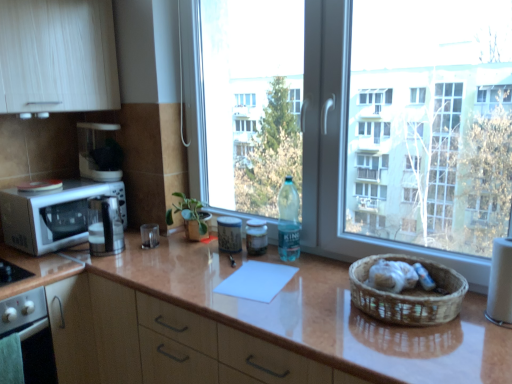
The image size is (512, 384). I want to click on unoccupied area in front of transparent glass window at center, so click(x=322, y=302).